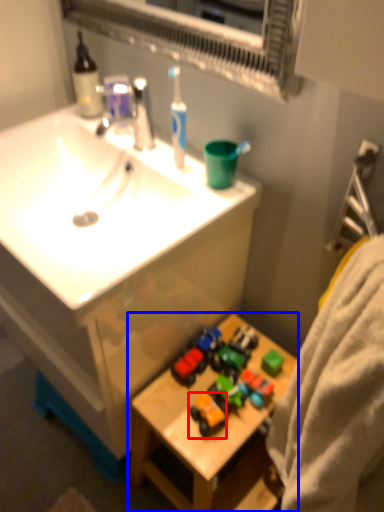
Question: Which of the following is the farthest to the observer, toy (highlighted by a red box) or table (highlighted by a blue box)?

Choices:
 (A) toy
 (B) table

Answer: (A)